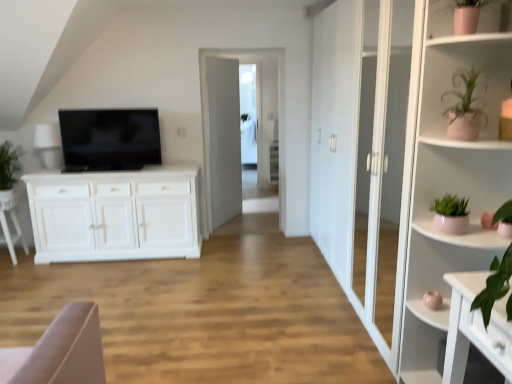
Where is `vacant area situated below transparent glass door at center (from a real-world perspective)`? vacant area situated below transparent glass door at center (from a real-world perspective) is located at coordinates (246, 230).